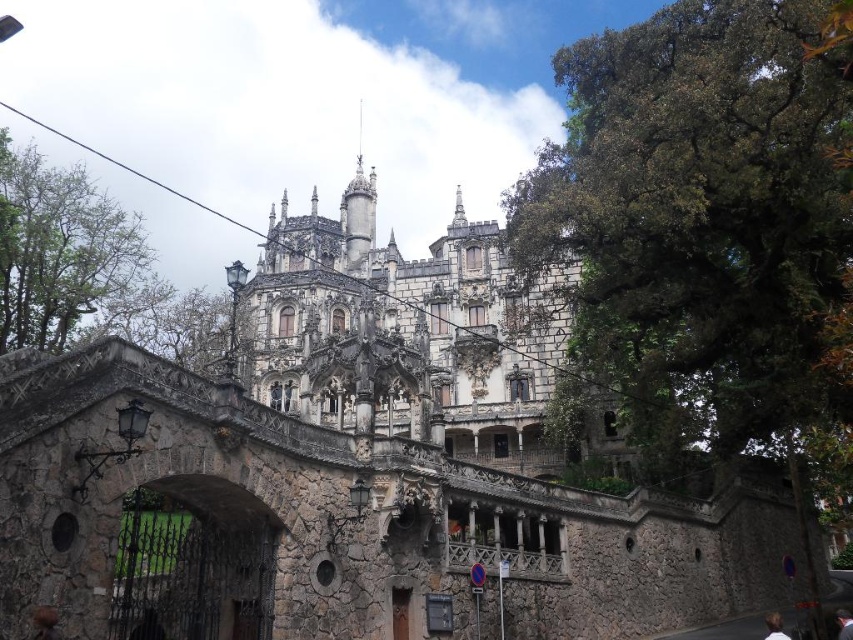
Between white hair at lower right and brown hair at upper center, which one appears on the right side from the viewer's perspective?

brown hair at upper center

Is point (764, 616) positioned after point (844, 612)?

That is True.

Image resolution: width=853 pixels, height=640 pixels. What are the coordinates of `white hair at lower right` in the screenshot? It's located at (775, 627).

The width and height of the screenshot is (853, 640). Find the location of `white hair at lower right`. white hair at lower right is located at coordinates (775, 627).